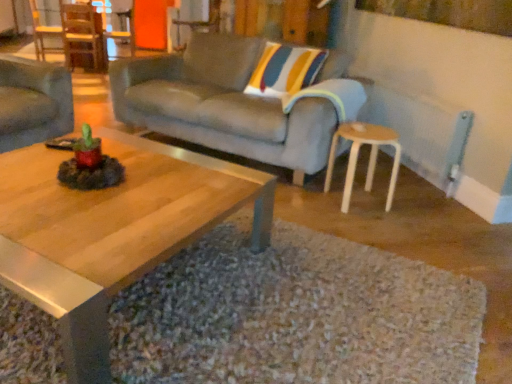
Question: Considering the positions of point (351, 160) and point (33, 36), is point (351, 160) closer or farther from the camera than point (33, 36)?

Choices:
 (A) closer
 (B) farther

Answer: (A)

Question: From a real-world perspective, is white plastic stool at lower right above or below wooden chair at left, the second chair viewed from the front?

Choices:
 (A) above
 (B) below

Answer: (B)

Question: Based on their relative distances, which object is nearer to the wooden chair at center, which is the first chair from front to back?

Choices:
 (A) gray fabric couch at center, placed as the 2th studio couch when sorted from left to right
 (B) matte gray couch at left, positioned as the second studio couch in right-to-left order
 (C) white plastic stool at lower right
 (D) wooden polished coffee table at center
 (E) wooden chair at left, placed as the 2th chair when sorted from right to left

Answer: (A)

Question: Which object is the farthest from the gray fabric couch at center, the 1th studio couch from the right?

Choices:
 (A) wooden chair at center, which is the first chair from front to back
 (B) matte gray couch at left, which is the 1th studio couch in left-to-right order
 (C) white plastic stool at lower right
 (D) wooden polished coffee table at center
 (E) wooden chair at left, which is the first chair from back to front

Answer: (E)